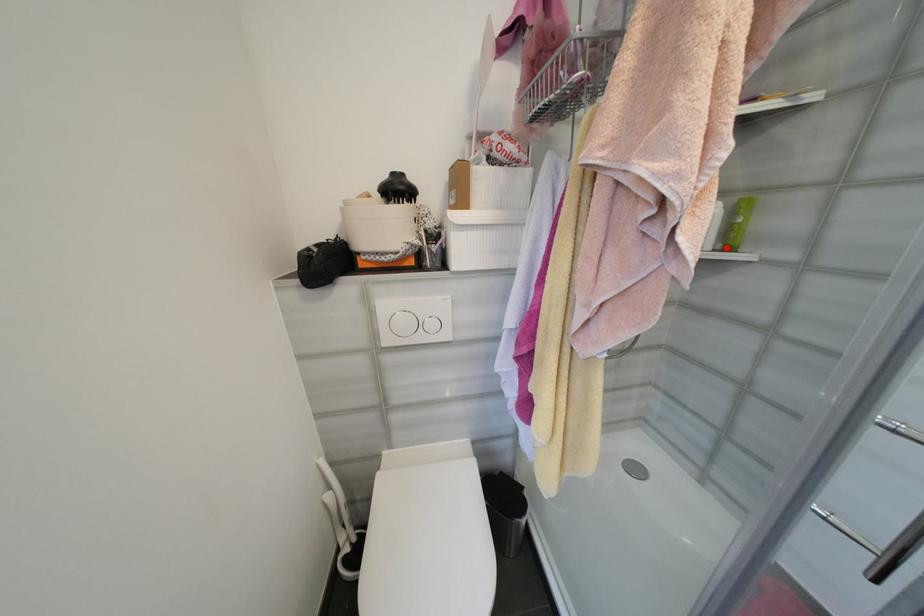
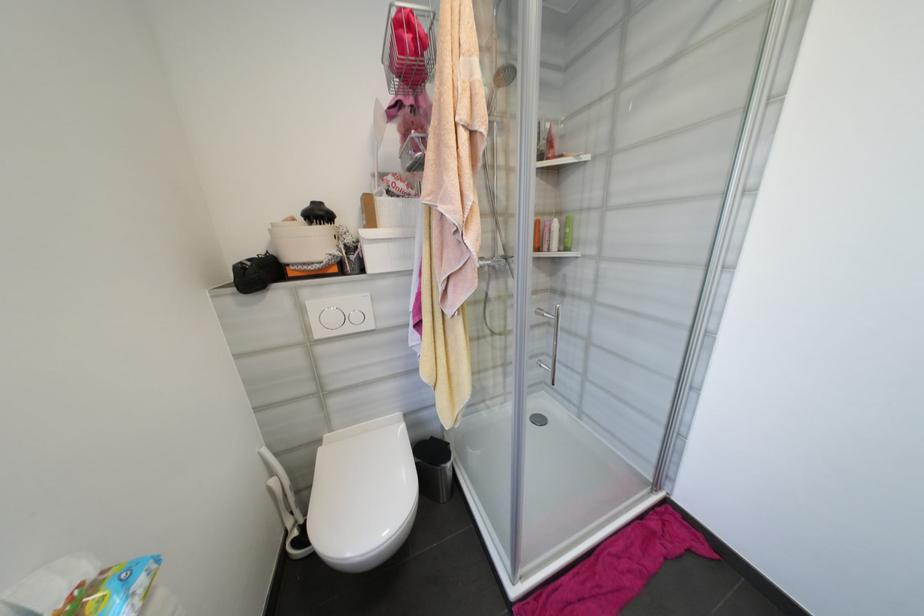
Where in the second image is the point corresponding to the highlighted location from the first image?

(567, 249)